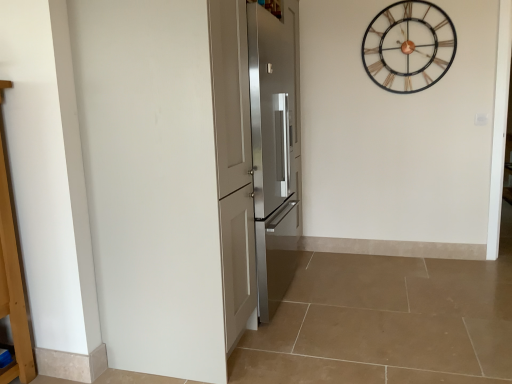
Question: Is satin silver refrigerator at center, the 1th door positioned from the front, to the left of metallic wireframe clock at upper right from the viewer's perspective?

Choices:
 (A) yes
 (B) no

Answer: (A)

Question: Does satin silver refrigerator at center, the second door in the back-to-front sequence, have a lesser width compared to metallic wireframe clock at upper right?

Choices:
 (A) yes
 (B) no

Answer: (B)

Question: Does satin silver refrigerator at center, the second door in the back-to-front sequence, come behind metallic wireframe clock at upper right?

Choices:
 (A) yes
 (B) no

Answer: (B)

Question: From a real-world perspective, is satin silver refrigerator at center, the second door in the back-to-front sequence, under metallic wireframe clock at upper right?

Choices:
 (A) no
 (B) yes

Answer: (B)

Question: From a real-world perspective, is satin silver refrigerator at center, the 1th door positioned from the front, physically above metallic wireframe clock at upper right?

Choices:
 (A) yes
 (B) no

Answer: (B)

Question: Considering their positions, is metallic wireframe clock at upper right located in front of or behind stainless steel refrigerator at center, marked as the 2th door in a front-to-back arrangement?

Choices:
 (A) front
 (B) behind

Answer: (B)

Question: Looking at their shapes, would you say metallic wireframe clock at upper right is wider or thinner than stainless steel refrigerator at center, the first door in the back-to-front sequence?

Choices:
 (A) wide
 (B) thin

Answer: (B)

Question: Choose the correct answer: Is metallic wireframe clock at upper right inside stainless steel refrigerator at center, marked as the 2th door in a front-to-back arrangement, or outside it?

Choices:
 (A) outside
 (B) inside

Answer: (A)

Question: From a real-world perspective, is metallic wireframe clock at upper right physically located above or below stainless steel refrigerator at center, marked as the 2th door in a front-to-back arrangement?

Choices:
 (A) below
 (B) above

Answer: (B)

Question: In terms of size, does metallic wireframe clock at upper right appear bigger or smaller than satin silver refrigerator at center, the 1th door positioned from the front?

Choices:
 (A) small
 (B) big

Answer: (A)

Question: Is metallic wireframe clock at upper right taller or shorter than satin silver refrigerator at center, the second door in the back-to-front sequence?

Choices:
 (A) tall
 (B) short

Answer: (B)

Question: Looking at their shapes, would you say metallic wireframe clock at upper right is wider or thinner than satin silver refrigerator at center, the second door in the back-to-front sequence?

Choices:
 (A) thin
 (B) wide

Answer: (A)

Question: Would you say metallic wireframe clock at upper right is to the left or to the right of satin silver refrigerator at center, the second door in the back-to-front sequence, in the picture?

Choices:
 (A) right
 (B) left

Answer: (A)

Question: From a real-world perspective, relative to metallic wireframe clock at upper right, is satin silver refrigerator at center, the 1th door positioned from the front, vertically above or below?

Choices:
 (A) above
 (B) below

Answer: (B)

Question: Considering the positions of satin silver refrigerator at center, the 1th door positioned from the front, and metallic wireframe clock at upper right in the image, is satin silver refrigerator at center, the 1th door positioned from the front, bigger or smaller than metallic wireframe clock at upper right?

Choices:
 (A) small
 (B) big

Answer: (B)